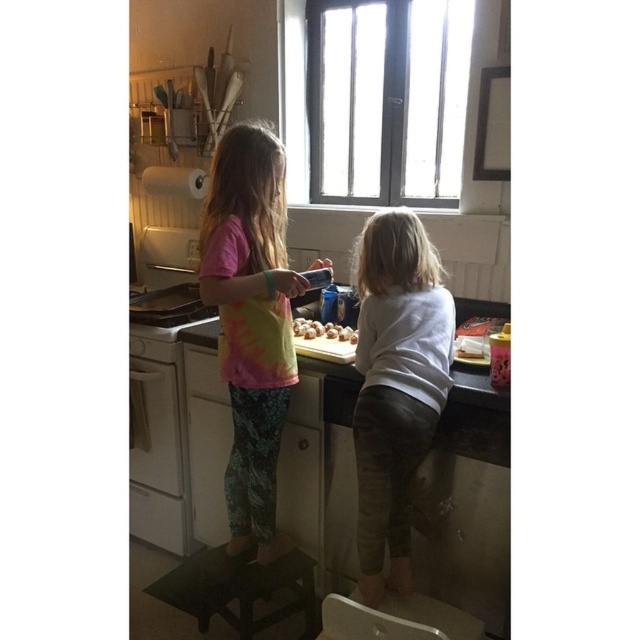
Question: Which of the following is the closest to the observer?

Choices:
 (A) (316, 333)
 (B) (308, 604)
 (C) (406, 316)

Answer: (C)

Question: Does white cotton shirt at right have a smaller size compared to black wood step stool at lower center?

Choices:
 (A) no
 (B) yes

Answer: (A)

Question: Which object appears closest to the camera in this image?

Choices:
 (A) white cotton shirt at right
 (B) brown matte eggs at center

Answer: (A)

Question: Does tie-dye fabric shirt at center appear under black wood step stool at lower center?

Choices:
 (A) yes
 (B) no

Answer: (B)

Question: Does black wood step stool at lower center appear on the left side of brown matte eggs at center?

Choices:
 (A) yes
 (B) no

Answer: (A)

Question: Which point appears farthest from the camera in this image?

Choices:
 (A) (232, 506)
 (B) (337, 324)
 (C) (300, 593)
 (D) (445, 394)

Answer: (B)